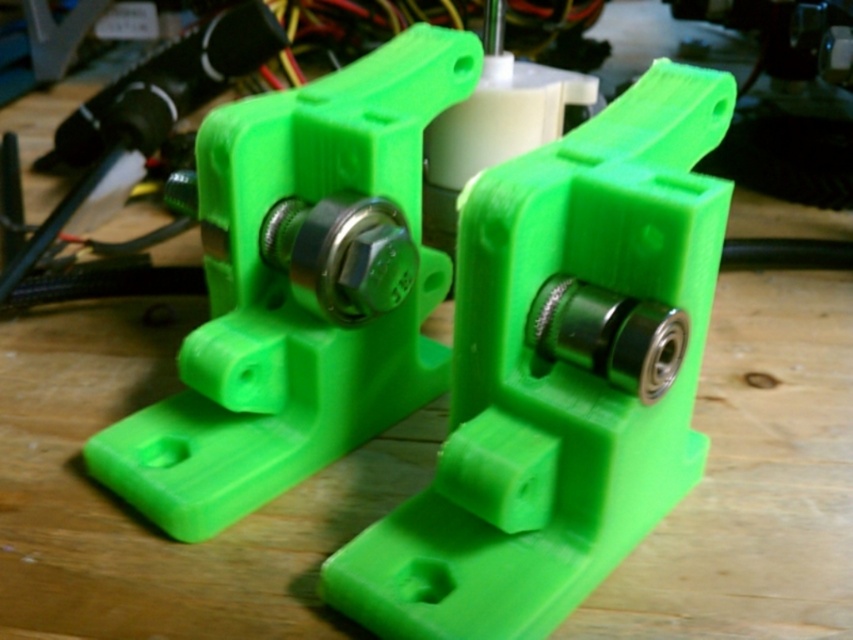
Question: Which point appears farthest from the camera in this image?

Choices:
 (A) (341, 257)
 (B) (628, 198)

Answer: (A)

Question: Is green matte plastic at center wider than green matte plastic object at center?

Choices:
 (A) yes
 (B) no

Answer: (B)

Question: Can you confirm if green matte plastic at center is positioned below green matte plastic object at center?

Choices:
 (A) yes
 (B) no

Answer: (A)

Question: Does green matte plastic at center come behind green matte plastic object at center?

Choices:
 (A) yes
 (B) no

Answer: (B)